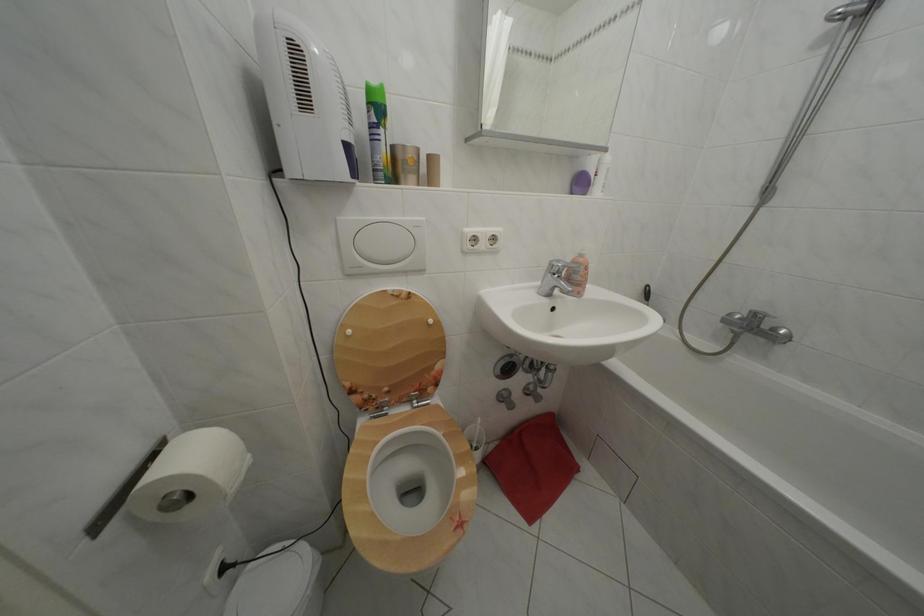
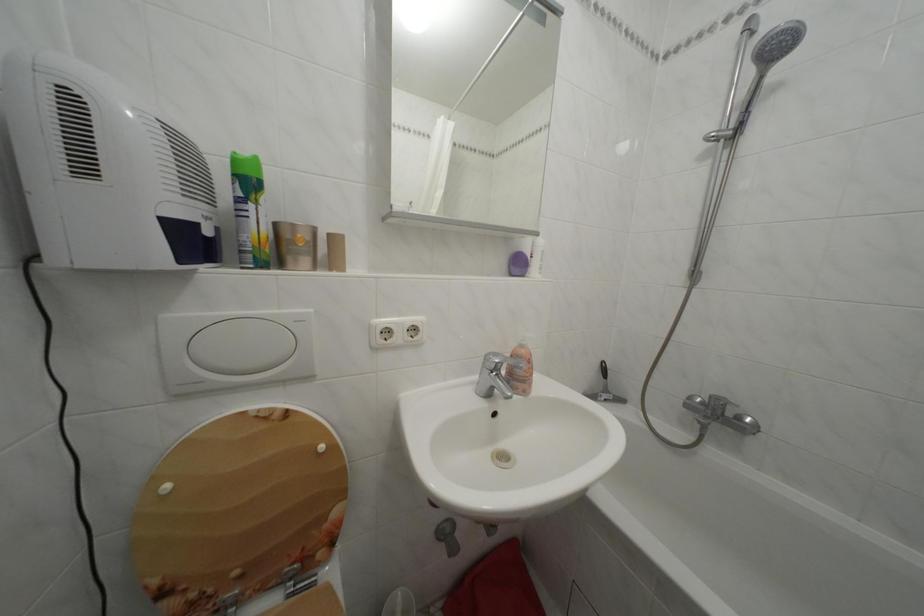
Find the pixel in the second image that matches pixel 348 225 in the first image.

(174, 323)